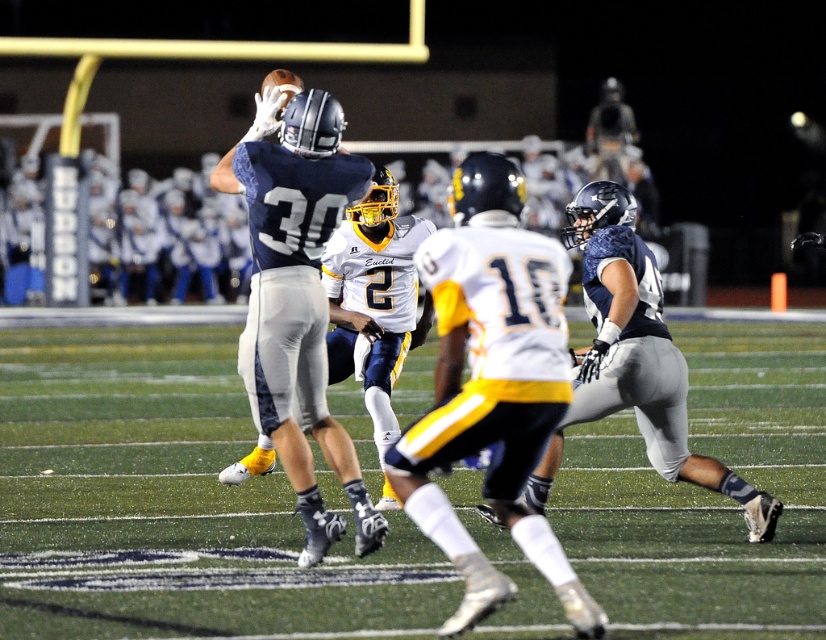
Is green turf at center bigger than white jersey at center?

Indeed, green turf at center has a larger size compared to white jersey at center.

Between green turf at center and white jersey at center, which one is positioned lower?

Positioned lower is green turf at center.

You are a GUI agent. You are given a task and a screenshot of the screen. Output one action in this format:
    pyautogui.click(x=<x>, y=<y>)
    Task: Click on the green turf at center
    Image resolution: width=826 pixels, height=640 pixels.
    Given the screenshot: What is the action you would take?
    pyautogui.click(x=169, y=504)

Locate an element on the screen. The width and height of the screenshot is (826, 640). green turf at center is located at coordinates (169, 504).

Identify the location of white jersey at center. The height and width of the screenshot is (640, 826). (492, 385).

Looking at this image, who is lower down, white jersey at center or matte blue helmet at center?

white jersey at center is below.

Measure the distance between point (471, 420) and camera.

Point (471, 420) and camera are 21.44 feet apart from each other.

Identify the location of white jersey at center. This screenshot has height=640, width=826. (492, 385).

Is point (176, 604) closer to camera compared to point (634, 209)?

Yes, it is.

Which of these two, green turf at center or matte blue jersey at center, stands taller?

Standing taller between the two is matte blue jersey at center.

Who is more distant from viewer, (297,570) or (606,326)?

Point (606,326)

You are a GUI agent. You are given a task and a screenshot of the screen. Output one action in this format:
    pyautogui.click(x=<x>, y=<y>)
    Task: Click on the green turf at center
    
    Given the screenshot: What is the action you would take?
    pyautogui.click(x=169, y=504)